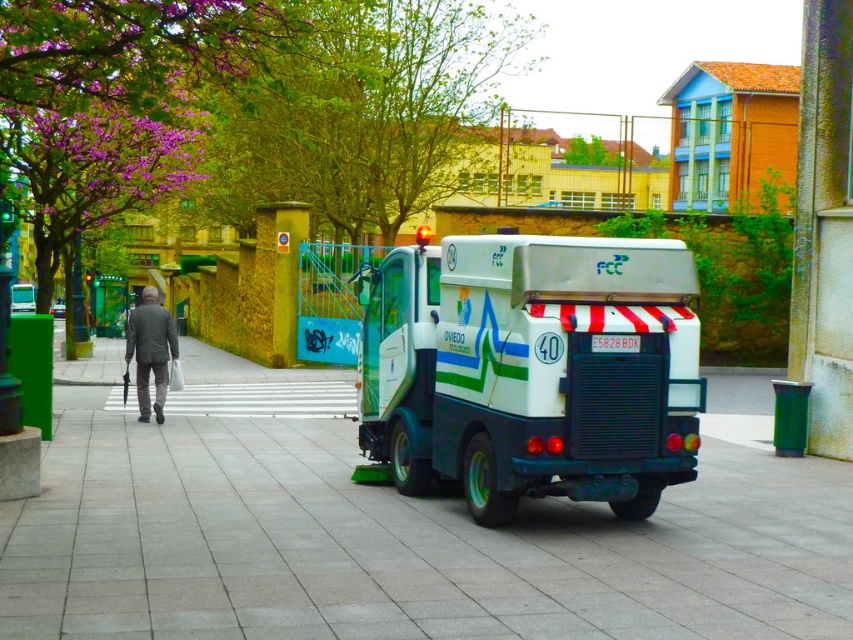
Please provide the coordinates of the white glossy street sweeper at center in the image.

The white glossy street sweeper at center is located at coordinates point (x=532, y=369).